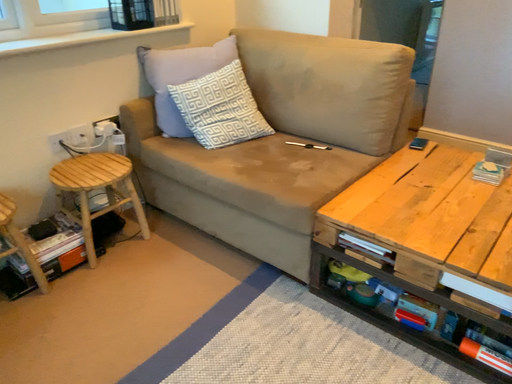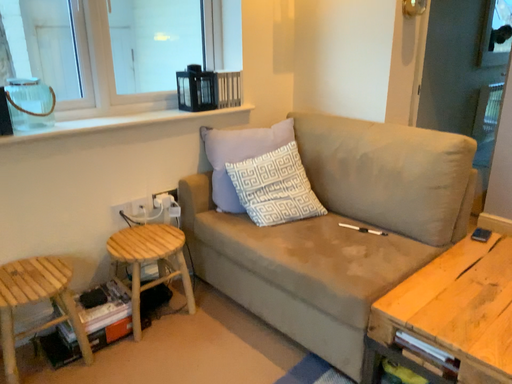
Question: How did the camera likely rotate when shooting the video?

Choices:
 (A) rotated upward
 (B) rotated downward

Answer: (A)